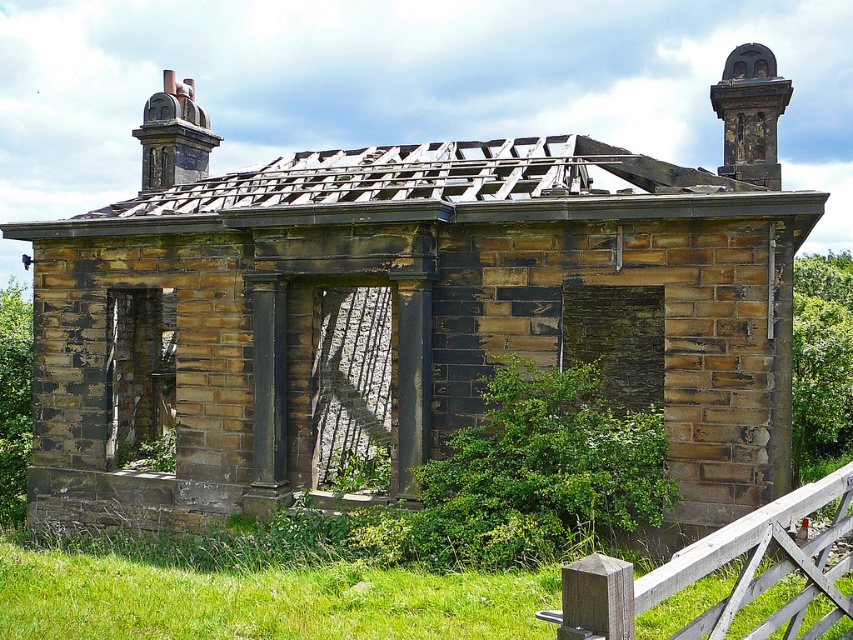
Question: Which point is closer to the camera taking this photo?

Choices:
 (A) (204, 173)
 (B) (657, 433)
 (C) (811, 492)
 (D) (3, 356)

Answer: (C)

Question: Is green leafy bush at center thinner than green leafy bush at left?

Choices:
 (A) yes
 (B) no

Answer: (A)

Question: Which is nearer to the wooden fence at lower right?

Choices:
 (A) green leafy bush at right
 (B) green leafy bush at center

Answer: (B)

Question: Observing the image, what is the correct spatial positioning of green leafy bush at left in reference to dark gray stone chimney at upper left?

Choices:
 (A) below
 (B) above

Answer: (A)

Question: Is green leafy bush at right to the left of green leafy bush at left from the viewer's perspective?

Choices:
 (A) yes
 (B) no

Answer: (B)

Question: Which point is closer to the camera?

Choices:
 (A) (28, 419)
 (B) (735, 109)
 (C) (805, 276)

Answer: (B)